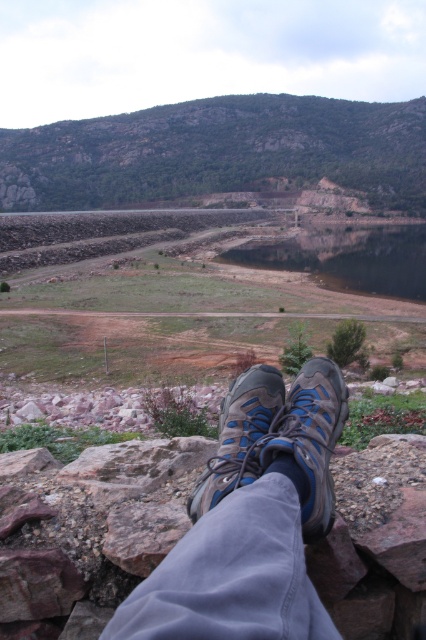
You are standing on a rocky ledge and want to place both of your blue suede shoes at center on the ground in front of you. How far apart should you place them to match the scene?

You should place the blue suede shoes at center 38.76 inches apart to match the scene.

You are standing on a rocky ledge and want to place a large backpack between the blue suede shoes at center and the smooth reflective water at center. Considering their sizes, can the backpack fit between them without overlapping either object?

The blue suede shoes at center has a lesser width compared to smooth reflective water at center, so the backpack can fit between them as there is enough space between the two objects.

You are standing on a rocky ledge and see the blue suede shoes at center and the blue mesh shoe at lower center. Which shoe is positioned lower in the scene?

The blue suede shoes at center are positioned lower than the blue mesh shoe at lower center.